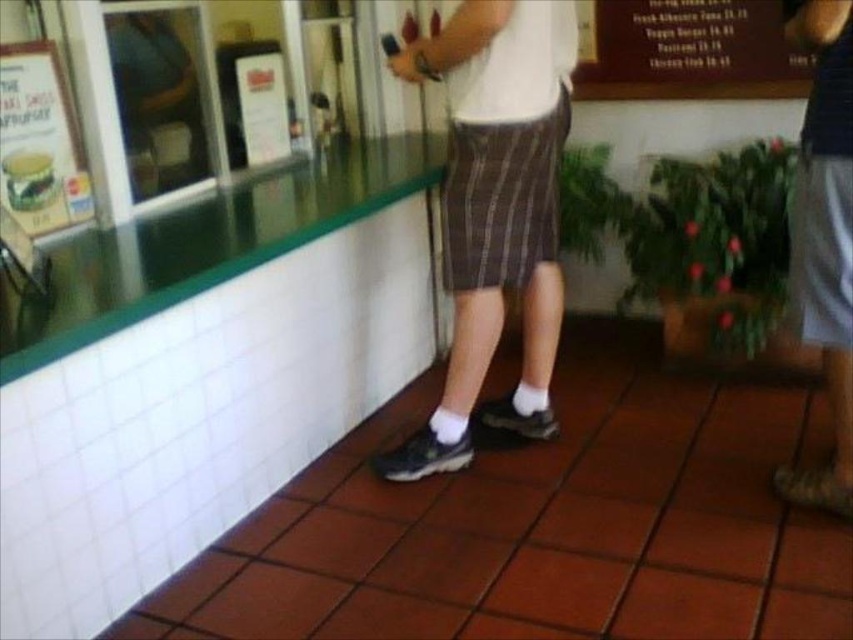
You are a customer at the restaurant and want to read the matte paper menu at upper left while standing near the white cotton socks at lower center. Can you see the entire menu without moving your position?

The matte paper menu at upper left is behind white cotton socks at lower center, so it might be partially blocked. You may need to adjust your position to see the entire menu.

You are a customer in the restaurant and want to place your gray cotton shorts at right on the wooden sign at upper right. Can you do that?

The gray cotton shorts at right and wooden sign at upper right are 35.96 inches apart, so you cannot place the gray cotton shorts at right on the wooden sign at upper right because they are too far apart.

You are standing at point [13,141] and want to walk to point [453,252]. Is the path clear of any obstacles?

Point [453,252] is behind point [13,141], so the path is blocked by point [13,141].